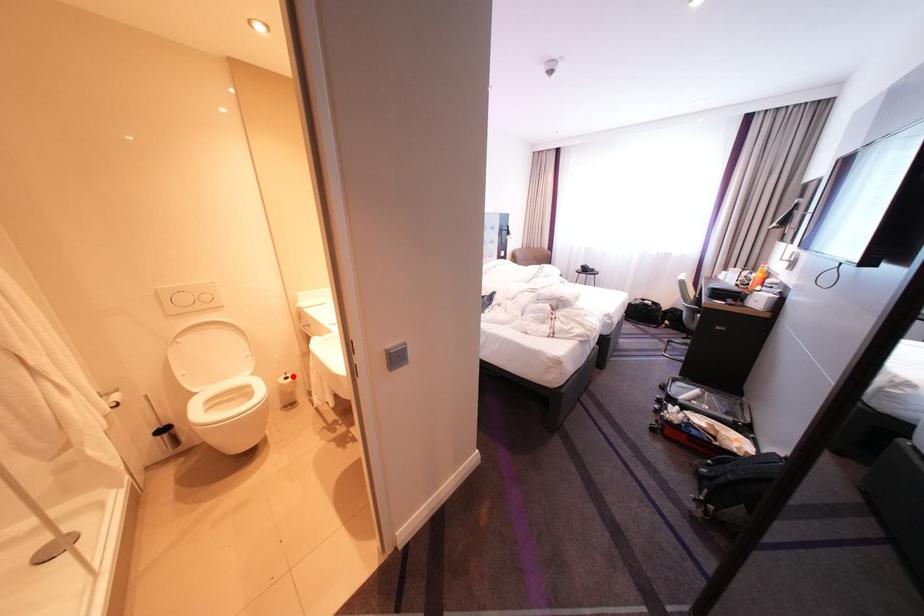
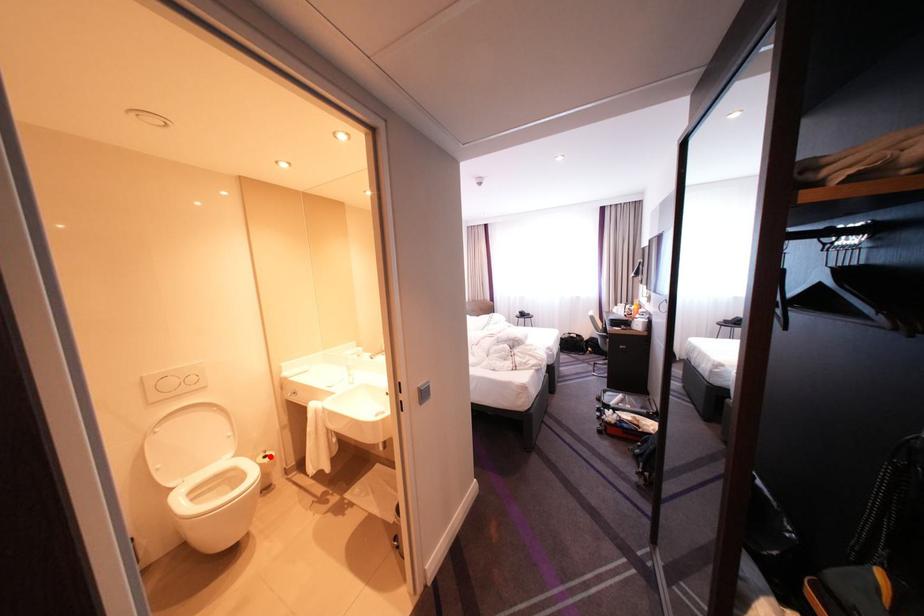
I am providing you with two images of the same scene from different viewpoints. A red point is marked on the first image and another point is marked on the second image. Is the red point in image1 aligned with the point shown in image2?

Yes